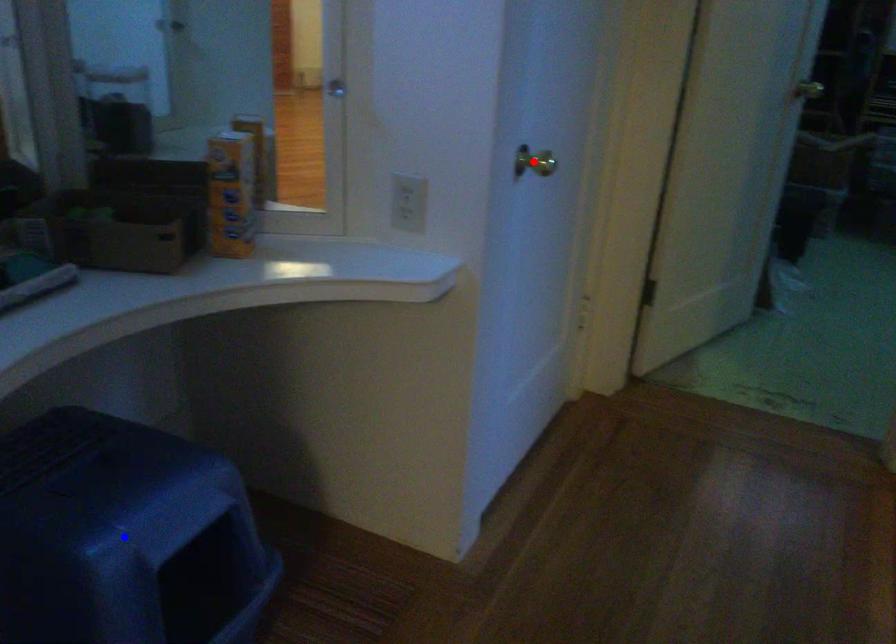
Question: Two points are marked on the image. Which point is closer to the camera?

Choices:
 (A) Blue point is closer.
 (B) Red point is closer.

Answer: (A)